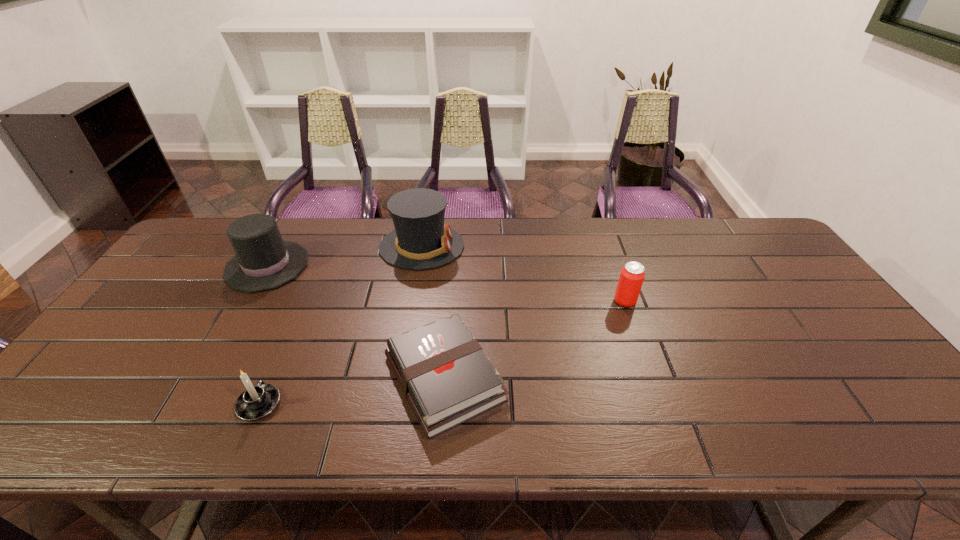
You are a GUI agent. You are given a task and a screenshot of the screen. Output one action in this format:
    pyautogui.click(x=<x>, y=<y>)
    Task: Click on the free location located 0.350m with a handle on the side of the candle holder
    
    Given the screenshot: What is the action you would take?
    pyautogui.click(x=310, y=286)

The image size is (960, 540). What are the coordinates of `vacant space located 0.320m with a handle on the side of the candle holder` in the screenshot? It's located at (307, 293).

Image resolution: width=960 pixels, height=540 pixels. I want to click on free space located 0.070m on the left of the hardback book, so click(352, 378).

The image size is (960, 540). Find the location of `candle holder at the near edge`. candle holder at the near edge is located at coordinates (256, 402).

Identify the location of hardback book at the near edge. The height and width of the screenshot is (540, 960). (446, 376).

I want to click on free spot at the far edge of the desktop, so click(573, 249).

What are the coordinates of `vacant space at the near edge of the desktop` in the screenshot? It's located at (357, 416).

The width and height of the screenshot is (960, 540). In order to click on free location at the left edge of the desktop in this screenshot , I will do `click(100, 393)`.

Identify the location of vacant space at the right edge. This screenshot has width=960, height=540. pyautogui.click(x=911, y=407).

Find the location of `vacant space at the far left corner of the desktop`. vacant space at the far left corner of the desktop is located at coordinates (x=200, y=253).